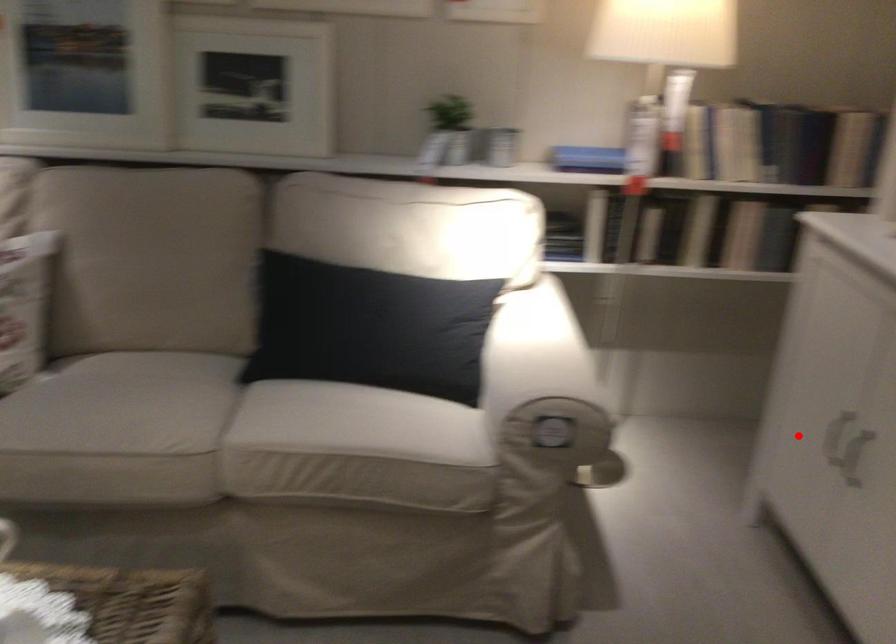
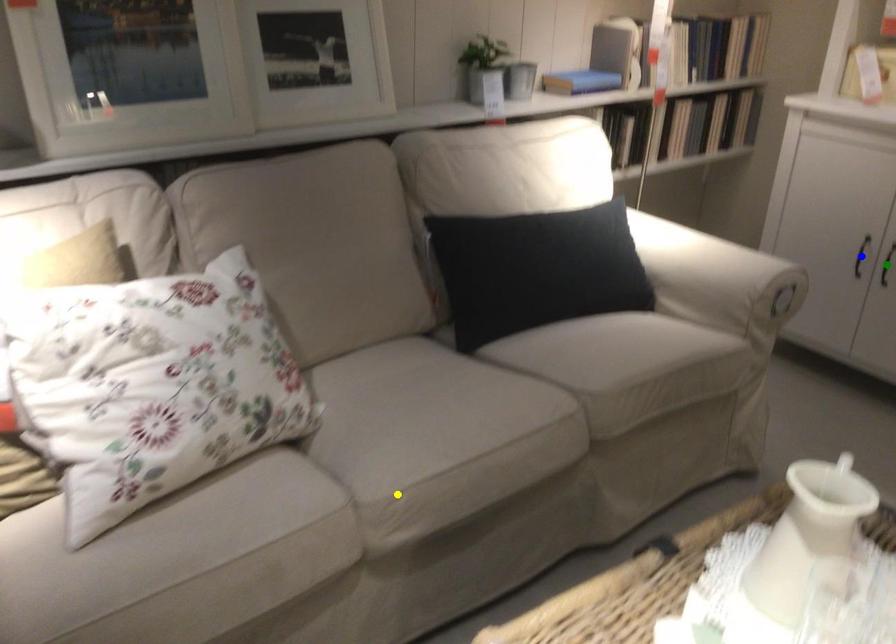
Question: I am providing you with two images of the same scene from different viewpoints. A red point is marked on the first image. You are given multiple points on the second image. Which point in image 2 is actually the same real-world point as the red point in image 1?

Choices:
 (A) yellow point
 (B) blue point
 (C) green point

Answer: (B)